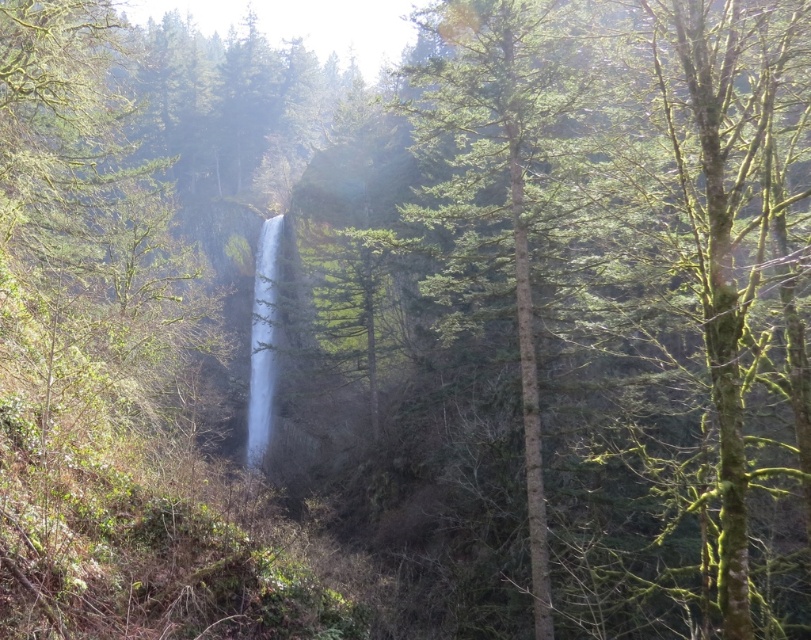
Is green textured tree at center shorter than clear water at center?

In fact, green textured tree at center may be taller than clear water at center.

Between point (522, 380) and point (251, 394), which one is positioned in front?

Positioned in front is point (522, 380).

Which is behind, point (526, 259) or point (271, 240)?

Positioned behind is point (271, 240).

Locate an element on the screen. green textured tree at center is located at coordinates (503, 186).